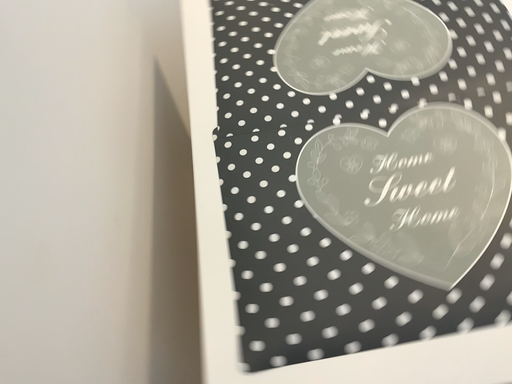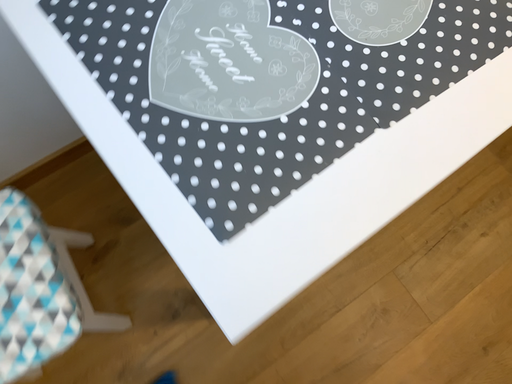
Question: How did the camera likely rotate when shooting the video?

Choices:
 (A) rotated upward
 (B) rotated downward

Answer: (B)